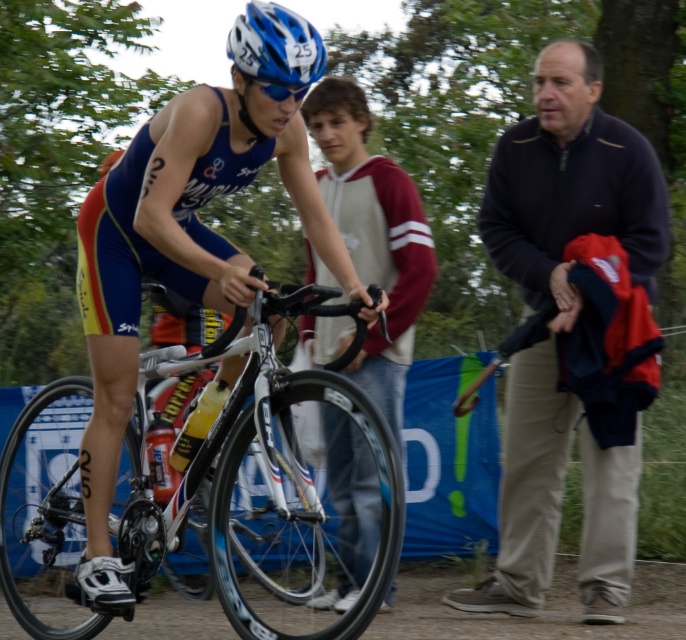
Image resolution: width=686 pixels, height=640 pixels. What are the coordinates of `white glossy bicycle at center` in the screenshot? It's located at tap(257, 484).

Identify the location of white glossy bicycle at center. The image size is (686, 640). (257, 484).

Measure the distance between white glossy bicycle at center and camera.

white glossy bicycle at center and camera are 5.34 meters apart from each other.

Can you confirm if white glossy bicycle at center is bigger than blue matte helmet at upper center?

Yes.

Who is more forward, (0,509) or (292,33)?

Point (292,33)

Locate an element on the screen. The width and height of the screenshot is (686, 640). white glossy bicycle at center is located at coordinates (257, 484).

Can you confirm if blue matte triathlon suit at center is positioned to the right of blue matte helmet at upper center?

In fact, blue matte triathlon suit at center is to the left of blue matte helmet at upper center.

Consider the image. Does blue matte triathlon suit at center have a lesser width compared to blue matte helmet at upper center?

No, blue matte triathlon suit at center is not thinner than blue matte helmet at upper center.

Between point (191, 177) and point (244, 17), which one is positioned in front?

Point (244, 17)

You are a GUI agent. You are given a task and a screenshot of the screen. Output one action in this format:
    pyautogui.click(x=<x>, y=<y>)
    Task: Click on the blue matte triathlon suit at center
    Image resolution: width=686 pixels, height=640 pixels.
    Given the screenshot: What is the action you would take?
    pyautogui.click(x=176, y=259)